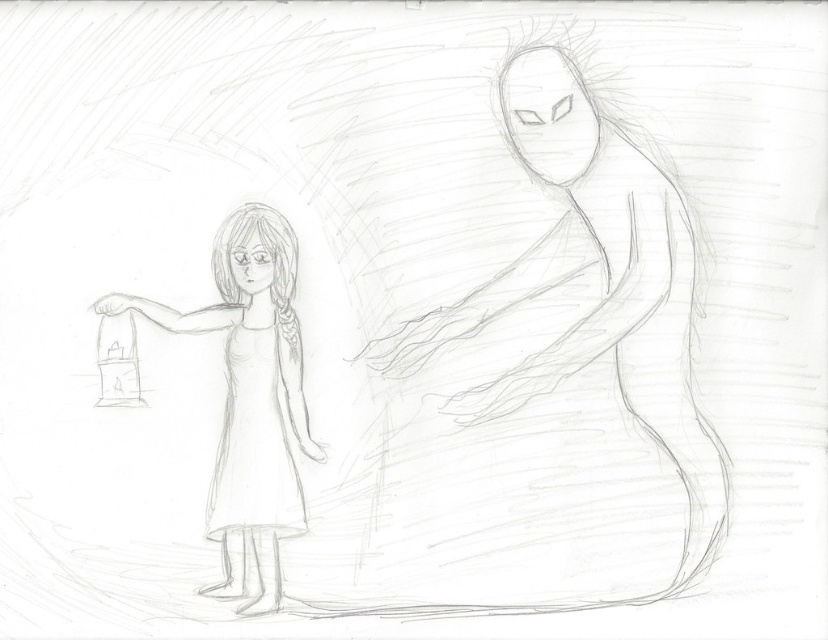
You are an artist trying to draw the scene described. If you want to make sure the smooth paper lantern at left and the white paper dress at center are proportionally accurate, which object should you draw first to establish scale?

You should draw the smooth paper lantern at left first because it is larger than the white paper dress at center, establishing the scale for the smaller object.

You are an artist trying to draw the scene described. You need to place the smooth paper lantern at left and the white paper dress at center correctly. Based on the description, which object should be placed to the left of the other?

The smooth paper lantern at left should be placed to the left of the white paper dress at center because the description states that the smooth paper lantern at left is positioned on the left side of white paper dress at center.